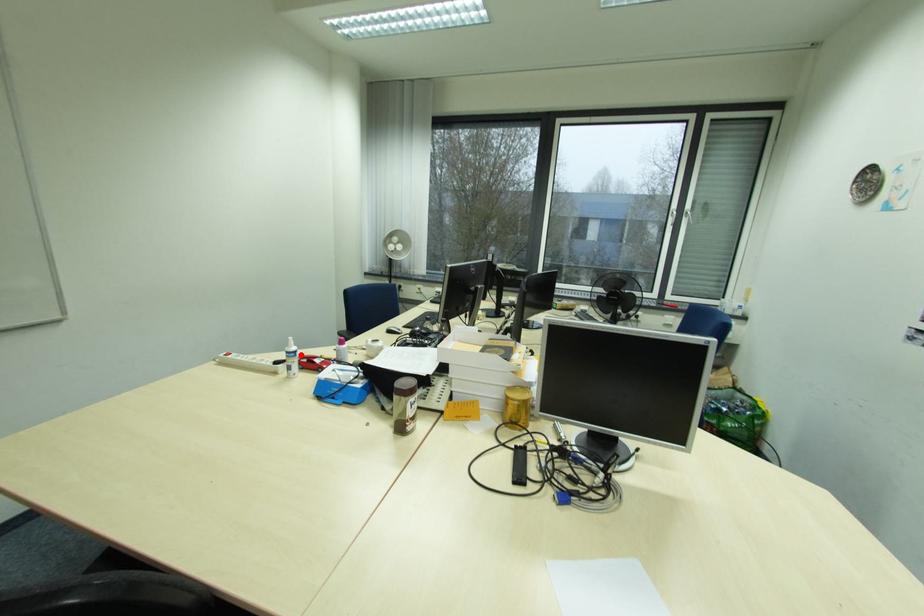
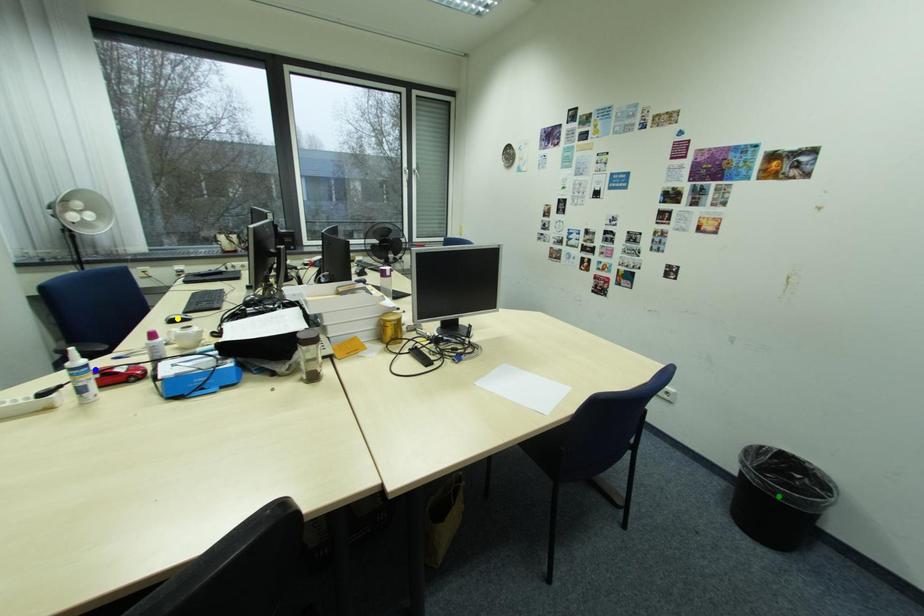
Question: I am providing you with two images of the same scene from different viewpoints. A red point is marked on the first image. You are given multiple points on the second image. Which point in image 2 is actually the same real-world point as the red point in image 1?

Choices:
 (A) yellow point
 (B) green point
 (C) blue point

Answer: (C)